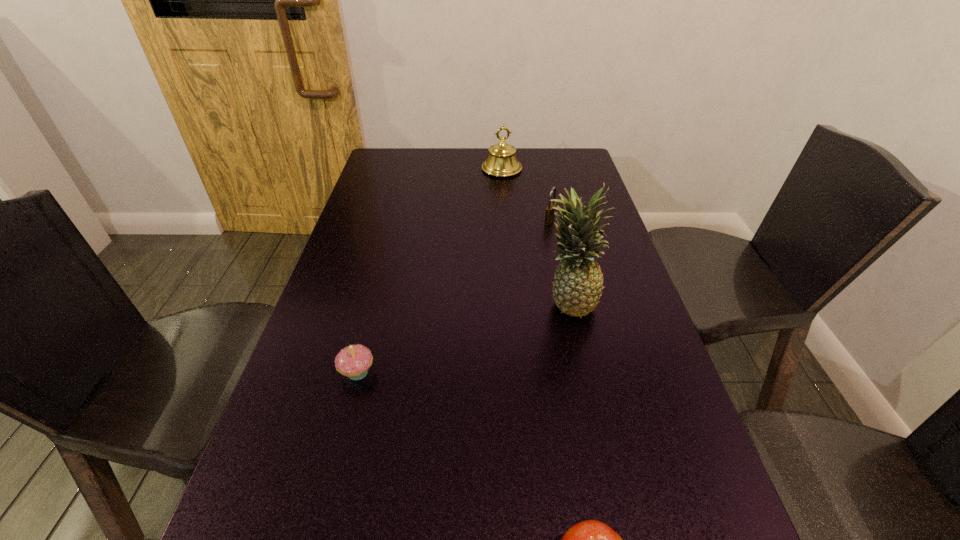
Identify the location of free space located 0.190m on the back of the cupcake. (376, 297).

At what (x,y) coordinates should I click in order to perform the action: click on object that is at the far edge. Please return your answer as a coordinate pair (x, y). This screenshot has height=540, width=960. Looking at the image, I should click on (502, 162).

You are a GUI agent. You are given a task and a screenshot of the screen. Output one action in this format:
    pyautogui.click(x=<x>, y=<y>)
    Task: Click on the object that is at the left edge
    The width and height of the screenshot is (960, 540).
    Given the screenshot: What is the action you would take?
    pyautogui.click(x=353, y=361)

Find the location of a particular element. The height and width of the screenshot is (540, 960). pineapple positioned at the right edge is located at coordinates (577, 287).

This screenshot has width=960, height=540. I want to click on padlock positioned at the right edge, so click(550, 212).

Identify the location of free location at the far edge of the desktop. (516, 156).

At what (x,y) coordinates should I click in order to perform the action: click on vacant space at the left edge of the desktop. Please return your answer as a coordinate pair (x, y). Looking at the image, I should click on (356, 214).

Find the location of `free location at the right edge`. free location at the right edge is located at coordinates (657, 482).

Find the location of a particular element. This screenshot has width=960, height=540. vacant space at the far right corner is located at coordinates (542, 149).

Where is `vacant space in between the second nearest object and the tallest object`? The height and width of the screenshot is (540, 960). vacant space in between the second nearest object and the tallest object is located at coordinates (463, 337).